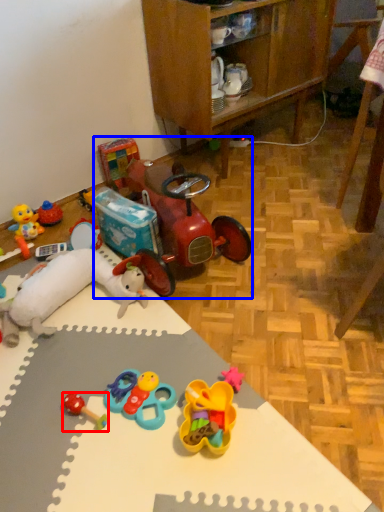
Question: Which of the following is the farthest to the observer, toy (highlighted by a red box) or toy car (highlighted by a blue box)?

Choices:
 (A) toy
 (B) toy car

Answer: (B)